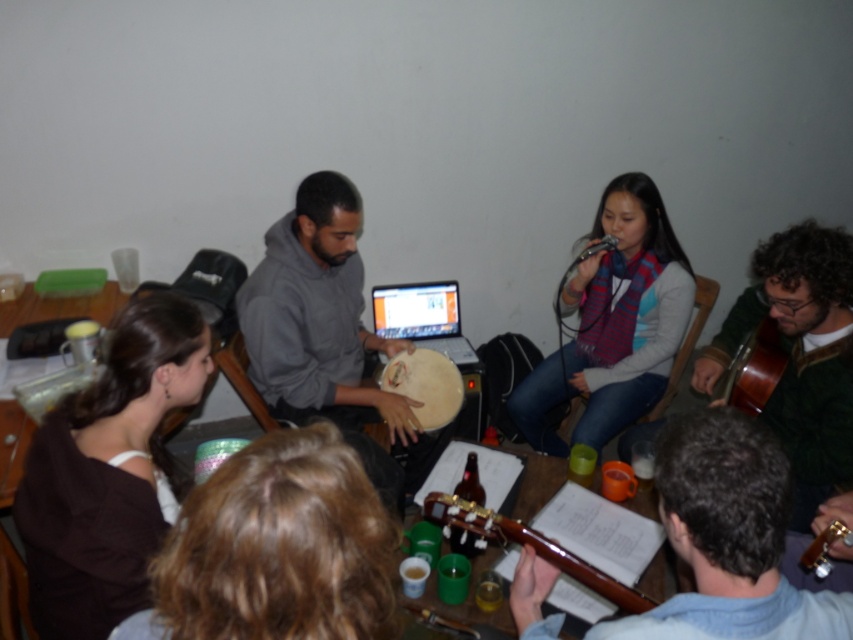
Can you confirm if brown fabric shirt at lower left is positioned below wooden table at lower left?

Yes, brown fabric shirt at lower left is below wooden table at lower left.

Where is `brown fabric shirt at lower left`? brown fabric shirt at lower left is located at coordinates (107, 472).

Is striped scarf at center wider than wooden acoustic guitar at lower center?

Correct, the width of striped scarf at center exceeds that of wooden acoustic guitar at lower center.

What are the coordinates of `striped scarf at center` in the screenshot? It's located at (613, 323).

Looking at this image, who is lower down, brown leather guitar at lower center or gray matte hoodie at center?

brown leather guitar at lower center is lower down.

Between point (637, 624) and point (273, 307), which one is positioned in front?

Point (637, 624) is in front.

At what (x,y) coordinates should I click in order to perform the action: click on brown leather guitar at lower center. Please return your answer as a coordinate pair (x, y). Looking at the image, I should click on (729, 538).